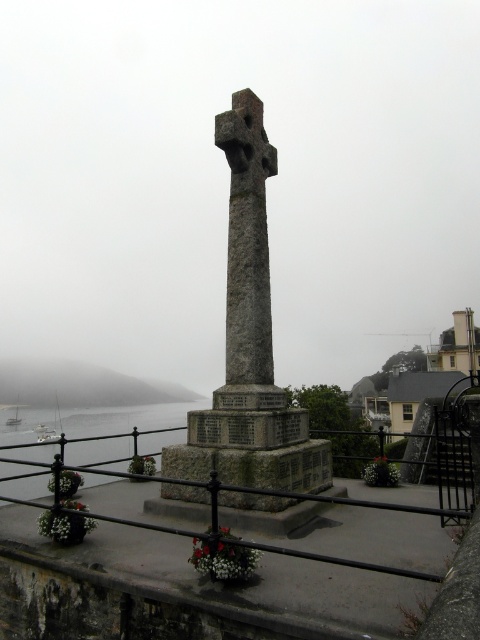
Question: Which of these objects is positioned closest to the rustic stone ledge at center?

Choices:
 (A) gray stone cross at center
 (B) foggy gray hillside at lower left
 (C) granite cross at center
 (D) clear water at lower left

Answer: (C)

Question: Can you confirm if rustic stone ledge at center is bigger than granite cross at center?

Choices:
 (A) yes
 (B) no

Answer: (B)

Question: Is rustic stone ledge at center to the left of gray stone cross at center from the viewer's perspective?

Choices:
 (A) yes
 (B) no

Answer: (A)

Question: Does granite cross at center have a lesser width compared to clear water at lower left?

Choices:
 (A) yes
 (B) no

Answer: (A)

Question: Among these objects, which one is nearest to the camera?

Choices:
 (A) gray stone cross at center
 (B) clear water at lower left
 (C) foggy gray hillside at lower left

Answer: (A)

Question: Which of these objects is positioned closest to the clear water at lower left?

Choices:
 (A) rustic stone ledge at center
 (B) granite cross at center
 (C) gray stone cross at center
 (D) foggy gray hillside at lower left

Answer: (D)